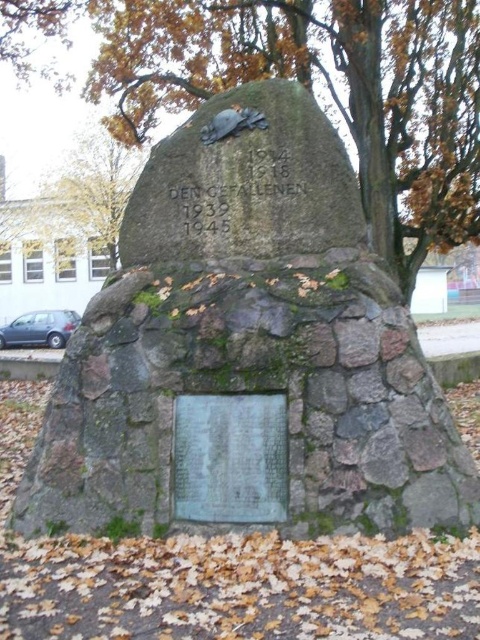
Is point (256, 260) closer to viewer compared to point (409, 44)?

That is True.

Describe the element at coordinates (247, 352) in the screenshot. I see `green mossy stone monument at center` at that location.

Locate an element on the screen. green mossy stone monument at center is located at coordinates (247, 352).

In the scene shown: Who is taller, green mossy stone monument at upper center or bronze plaque at center?

green mossy stone monument at upper center

I want to click on green mossy stone monument at upper center, so click(x=305, y=88).

Is point (458, 97) positioned in front of point (242, 403)?

No, (458, 97) is behind (242, 403).

At what (x,y) coordinates should I click in order to perform the action: click on green mossy stone monument at upper center. Please return your answer as a coordinate pair (x, y). This screenshot has height=640, width=480. Looking at the image, I should click on (305, 88).

Can you confirm if green mossy stone monument at center is thinner than bronze plaque at center?

No, green mossy stone monument at center is not thinner than bronze plaque at center.

Can you confirm if green mossy stone monument at center is shorter than bronze plaque at center?

Incorrect, green mossy stone monument at center's height does not fall short of bronze plaque at center's.

Is point (348, 289) positioned after point (218, 490)?

Yes.

This screenshot has height=640, width=480. What are the coordinates of `green mossy stone monument at center` in the screenshot? It's located at (247, 352).